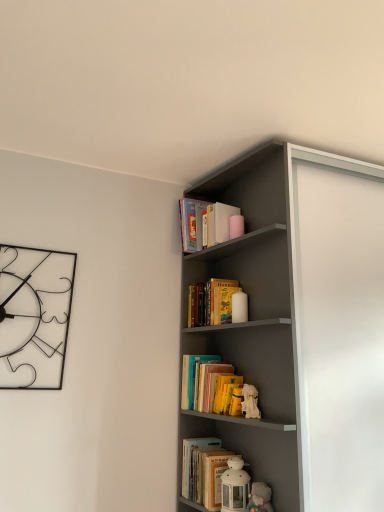
Question: From a real-world perspective, is hardcover book at center, the third book positioned from the back, located higher than yellow paper book at upper center, acting as the 2th book starting from the back?

Choices:
 (A) yes
 (B) no

Answer: (B)

Question: From the image's perspective, is hardcover book at center, the third book positioned from the back, on yellow paper book at upper center, which is counted as the 2th book, starting from the bottom?

Choices:
 (A) yes
 (B) no

Answer: (B)

Question: Is hardcover book at center, which is the first book in front-to-back order, next to yellow paper book at upper center, which is counted as the 2th book, starting from the bottom?

Choices:
 (A) no
 (B) yes

Answer: (A)

Question: Is there a large distance between hardcover book at center, arranged as the third book when viewed from the top, and yellow paper book at upper center, the 2th book positioned from the front?

Choices:
 (A) yes
 (B) no

Answer: (B)

Question: Is hardcover book at center, which is the first book in front-to-back order, completely or partially outside of yellow paper book at upper center, the 2th book positioned from the front?

Choices:
 (A) yes
 (B) no

Answer: (A)

Question: Considering the positions of white plush toy at middle, arranged as the 2th toy when ordered from the bottom, and matte gray bookshelf at upper right in the image, is white plush toy at middle, arranged as the 2th toy when ordered from the bottom, taller or shorter than matte gray bookshelf at upper right?

Choices:
 (A) short
 (B) tall

Answer: (A)

Question: Would you say white plush toy at middle, which is the 1th toy from top to bottom, is inside or outside matte gray bookshelf at upper right?

Choices:
 (A) inside
 (B) outside

Answer: (B)

Question: Looking at the image, does white plush toy at middle, which is the 1th toy from top to bottom, seem bigger or smaller compared to matte gray bookshelf at upper right?

Choices:
 (A) big
 (B) small

Answer: (B)

Question: In the image, is white plush toy at middle, which is the 1th toy from top to bottom, on the left side or the right side of matte gray bookshelf at upper right?

Choices:
 (A) left
 (B) right

Answer: (A)

Question: Is hardcover book at center, arranged as the third book when viewed from the top, inside the boundaries of white matte lantern at lower center, the second toy when ordered from top to bottom, or outside?

Choices:
 (A) inside
 (B) outside

Answer: (B)

Question: From the image's perspective, relative to white matte lantern at lower center, placed as the first toy when sorted from bottom to top, is hardcover book at center, the 1th book in the bottom-to-top sequence, above or below?

Choices:
 (A) above
 (B) below

Answer: (B)

Question: Does point [218, 483] appear closer or farther from the camera than point [236, 485]?

Choices:
 (A) farther
 (B) closer

Answer: (A)

Question: Is hardcover book at center, the third book positioned from the back, wider or thinner than white matte lantern at lower center, placed as the first toy when sorted from bottom to top?

Choices:
 (A) thin
 (B) wide

Answer: (A)

Question: Considering their positions, is white plush toy at middle, which is the 1th toy from top to bottom, located in front of or behind yellow paper book at upper center, the 2th book when ordered from top to bottom?

Choices:
 (A) front
 (B) behind

Answer: (A)

Question: Considering the positions of point (254, 413) and point (193, 311), is point (254, 413) closer or farther from the camera than point (193, 311)?

Choices:
 (A) farther
 (B) closer

Answer: (B)